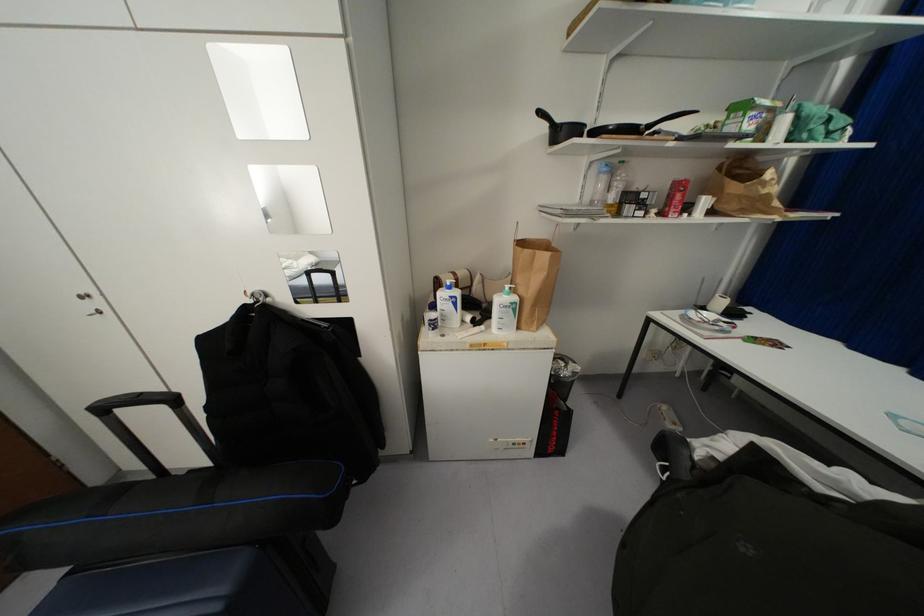
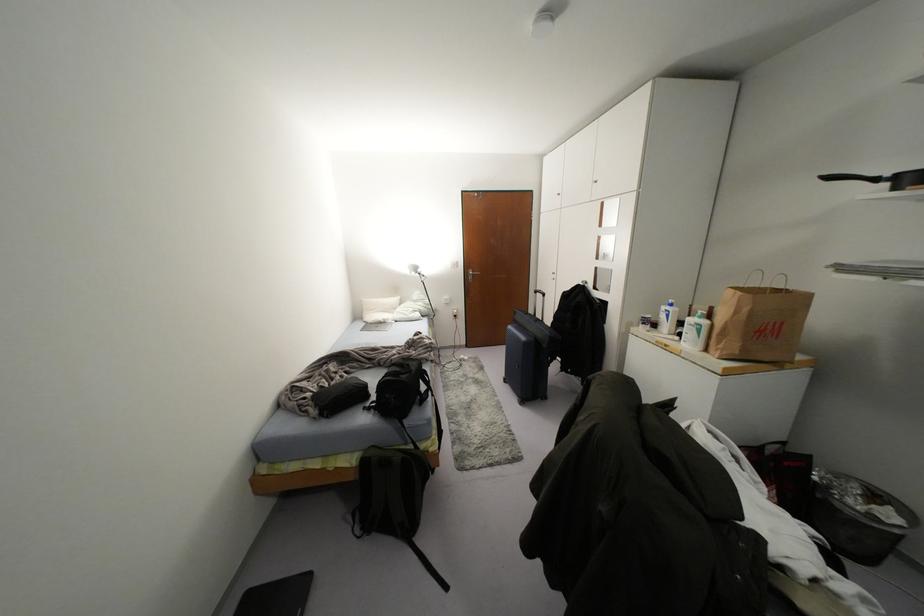
In the second image, find the point that corresponds to [541,113] in the first image.

(829, 177)